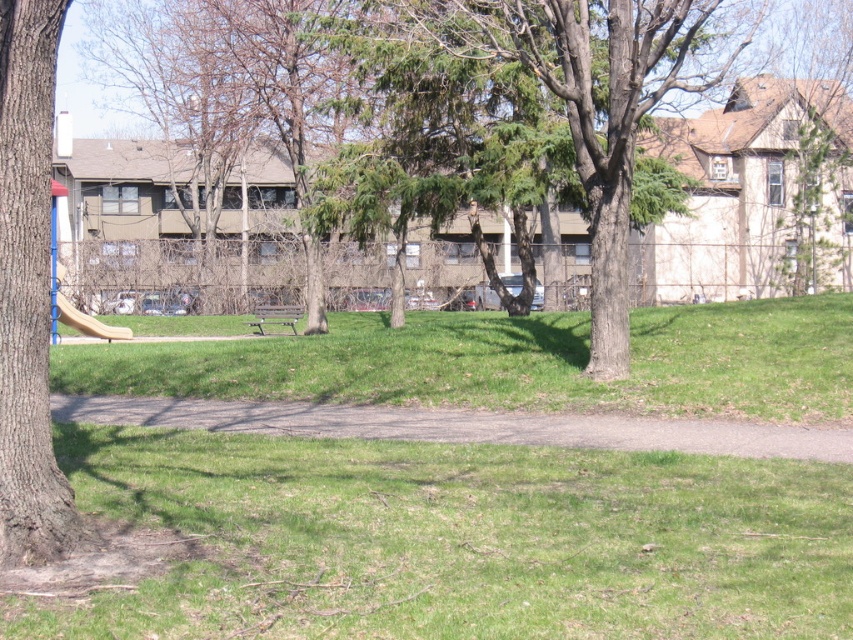
Between brown rough bark tree at left and wooden bench at center, which one has less height?

Standing shorter between the two is wooden bench at center.

From the picture: Can you confirm if brown rough bark tree at left is positioned below wooden bench at center?

Indeed, brown rough bark tree at left is positioned under wooden bench at center.

Which is in front, point (38, 186) or point (302, 314)?

Positioned in front is point (38, 186).

The height and width of the screenshot is (640, 853). I want to click on brown rough bark tree at left, so click(x=27, y=291).

Is the position of light brown plastic slide at left less distant than that of wooden bench at center?

That is True.

In order to click on light brown plastic slide at left in this screenshot , I will do `click(71, 304)`.

Between light brown plastic slide at left and light brown plastic slide at lower left, which one has more height?

light brown plastic slide at left

This screenshot has width=853, height=640. Find the location of `light brown plastic slide at left`. light brown plastic slide at left is located at coordinates (71, 304).